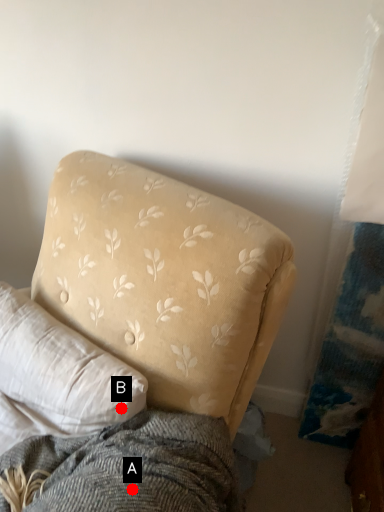
Question: Two points are circled on the image, labeled by A and B beside each circle. Among these points, which one is nearest to the camera?

Choices:
 (A) A is closer
 (B) B is closer

Answer: (A)